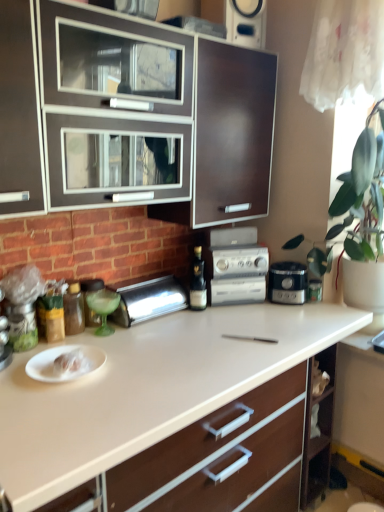
At what (x,y) coordinates should I click in order to perform the action: click on vacant space to the right of silver metallic breadbox at left, acting as the 2th appliance starting from the front. Please return your answer as a coordinate pair (x, y). Image resolution: width=384 pixels, height=512 pixels. Looking at the image, I should click on (205, 321).